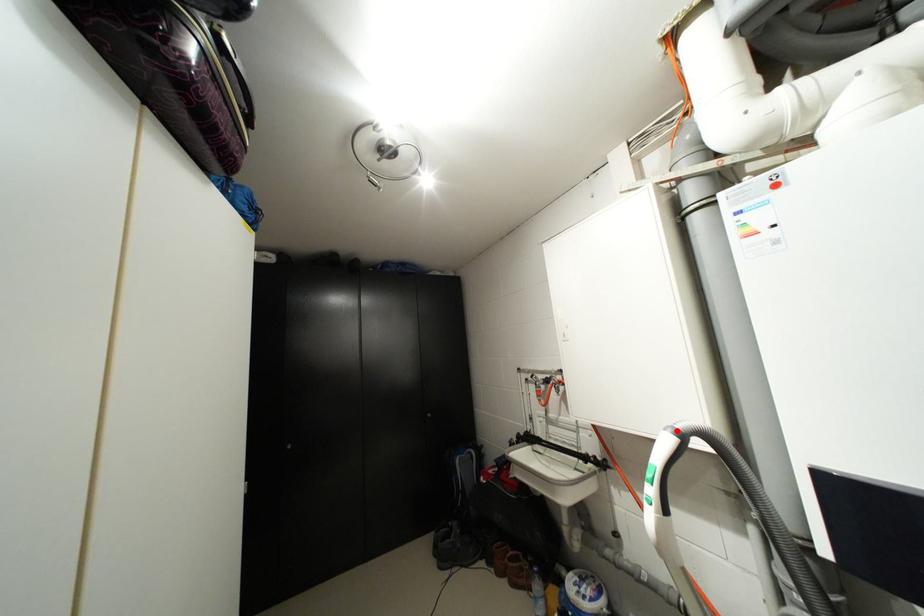
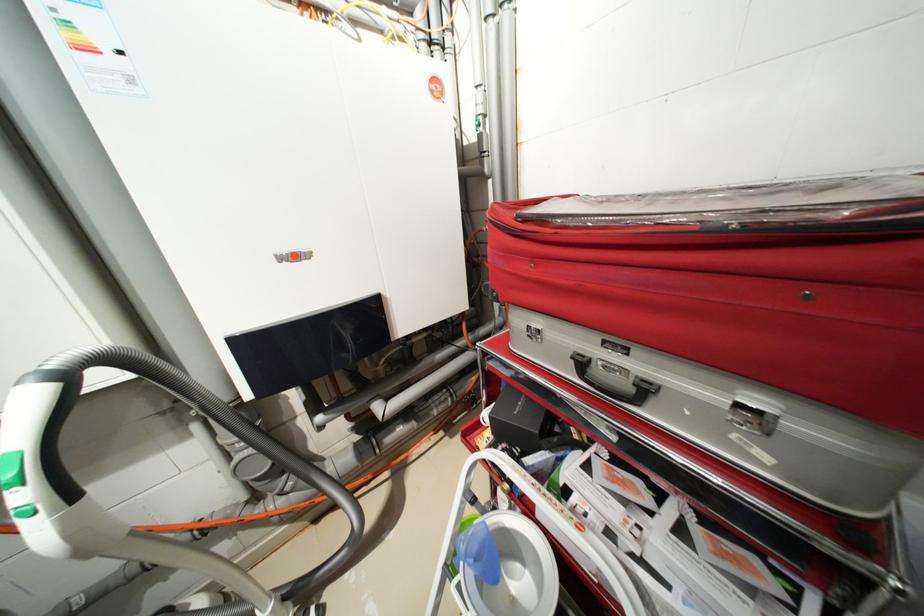
Question: I am providing you with two images of the same scene from different viewpoints. Given a red point in image1, look at the same physical point in image2. Is it:

Choices:
 (A) Closer to the viewpoint
 (B) Farther from the viewpoint

Answer: (A)